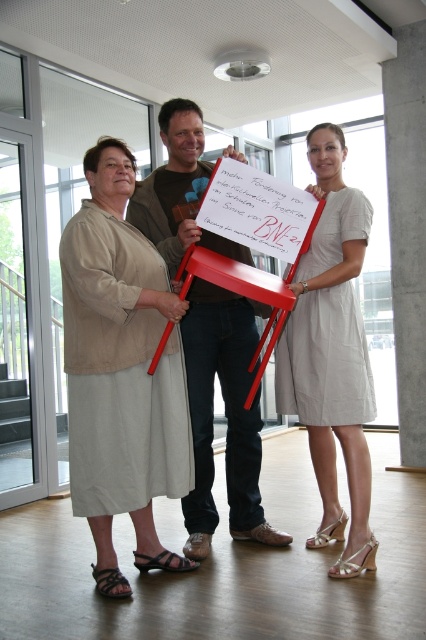
In the scene shown: Who is lower down, beige fabric dress at left or light beige dress at center?

Positioned lower is beige fabric dress at left.

Which is in front, point (100, 376) or point (360, 241)?

Point (100, 376)

Is point (83, 262) positioned after point (336, 388)?

No, it is not.

Locate an element on the screen. This screenshot has height=640, width=426. beige fabric dress at left is located at coordinates (120, 372).

Which is in front, point (316, 240) or point (184, 340)?

Point (316, 240)

Who is taller, light beige dress at center or matte brown shirt at center?

Standing taller between the two is matte brown shirt at center.

Which is in front, point (356, 372) or point (259, 436)?

Point (356, 372)

This screenshot has width=426, height=640. I want to click on light beige dress at center, so click(331, 353).

In the scene shown: Can you confirm if beige fabric dress at left is positioned above matte brown shirt at center?

Actually, beige fabric dress at left is below matte brown shirt at center.

Consider the image. Who is lower down, beige fabric dress at left or matte brown shirt at center?

Positioned lower is beige fabric dress at left.

What do you see at coordinates (120, 372) in the screenshot?
I see `beige fabric dress at left` at bounding box center [120, 372].

The height and width of the screenshot is (640, 426). Identify the location of beige fabric dress at left. (120, 372).